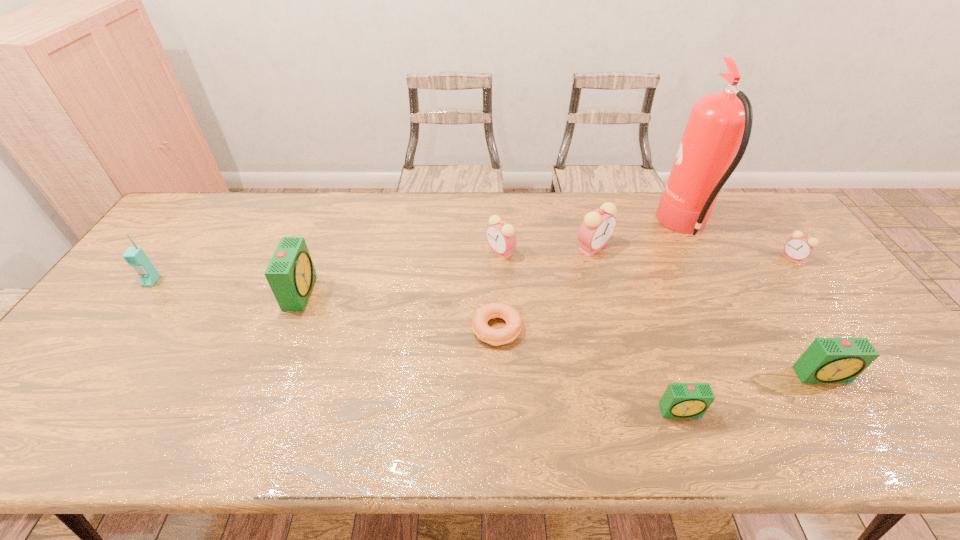
Where is `the rightmost alarm clock`? The height and width of the screenshot is (540, 960). the rightmost alarm clock is located at coordinates (799, 247).

The image size is (960, 540). Identify the location of the rightmost pink alarm clock. pos(799,247).

Where is `the smallest green alarm clock`? the smallest green alarm clock is located at coordinates (680, 400).

The image size is (960, 540). Find the location of `the second green alarm clock from left to right`. the second green alarm clock from left to right is located at coordinates (680, 400).

Identify the location of tan bagel. This screenshot has width=960, height=540. (496, 337).

At what (x,y) coordinates should I click in order to perform the action: click on the shortest object. Please return your answer as a coordinate pair (x, y). The image size is (960, 540). Looking at the image, I should click on (496, 337).

Identify the location of vacant region located towards the nozzle of the third object from right to left. (615, 227).

Identify the location of vacant region located towards the nozzle of the third object from right to left. The image size is (960, 540). (621, 227).

Image resolution: width=960 pixels, height=540 pixels. Find the location of `free spot located towards the nozzle of the third object from right to left`. free spot located towards the nozzle of the third object from right to left is located at coordinates (555, 227).

Locate an element on the screen. This screenshot has width=960, height=540. blank space located on the keypad of the cellular telephone is located at coordinates (58, 408).